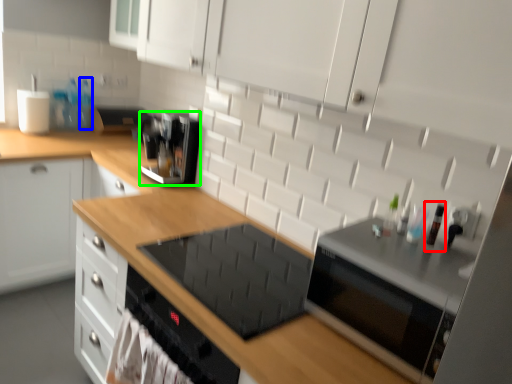
Question: Based on their relative distances, which object is nearer to bottle (highlighted by a red box)? Choose from bottle (highlighted by a blue box) and kitchen appliance (highlighted by a green box).

Choices:
 (A) bottle
 (B) kitchen appliance

Answer: (B)